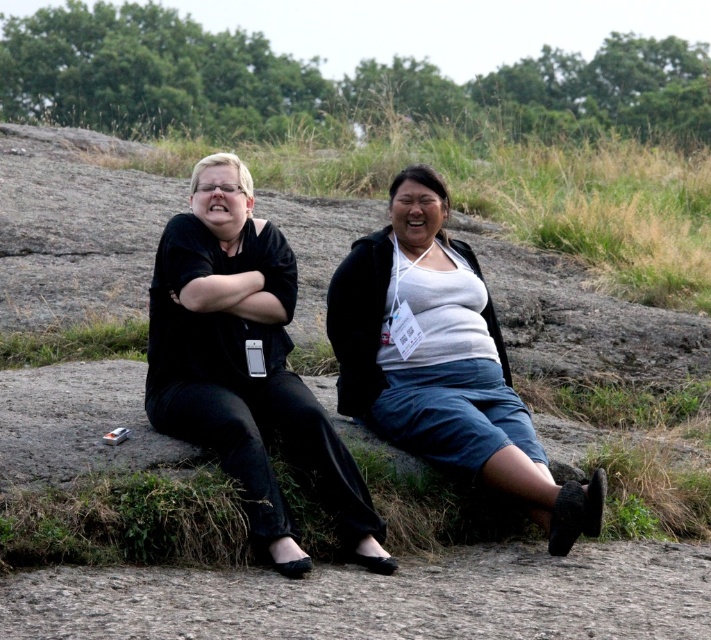
Question: Which point is farther to the camera?

Choices:
 (A) pos(218,186)
 (B) pos(491,468)

Answer: (A)

Question: Considering the relative positions of black matte/black pants at left and white matte tank top at center in the image provided, where is black matte/black pants at left located with respect to white matte tank top at center?

Choices:
 (A) left
 (B) right

Answer: (A)

Question: Can you confirm if black matte/black pants at left is bigger than white matte tank top at center?

Choices:
 (A) no
 (B) yes

Answer: (A)

Question: Which point is farther to the camera?

Choices:
 (A) (427, 376)
 (B) (311, 433)

Answer: (A)

Question: Is black matte/black pants at left above white matte tank top at center?

Choices:
 (A) no
 (B) yes

Answer: (B)